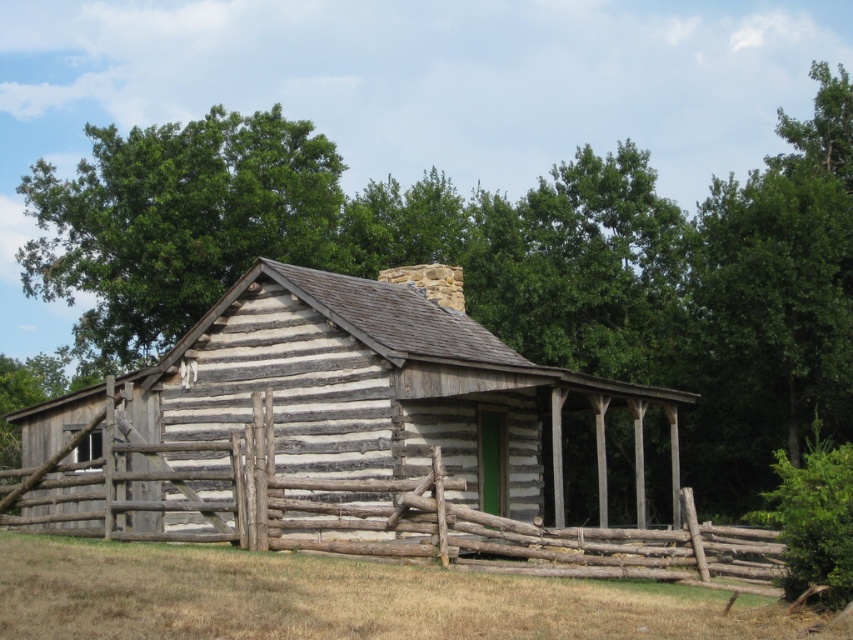
You are standing in front of the rustic log cabin and want to take a photo of the weathered wood fence at lower center. If your camera can focus on objects up to 100 feet away, will you be able to capture a clear image of the fence?

The weathered wood fence at lower center is 90.36 feet away from the camera. Since the camera can focus up to 100 feet, it is within the range, so you can capture a clear image.

You are a painter standing at the base of the weathered wood fence at lower center. You want to paint the green leafy tree at upper left but need to know if the fence is narrow enough to step around without damaging it. Can you determine if the fence is narrow enough based on its width compared to the tree?

The weathered wood fence at lower center is thinner than the green leafy tree at upper left, so it is narrow enough to step around without damaging it.

You are standing in front of the rustic log cabin and want to know the exact location of the brown wooden fence at lower center. Can you determine its coordinates based on the scene?

The brown wooden fence at lower center is located at point [345,598].